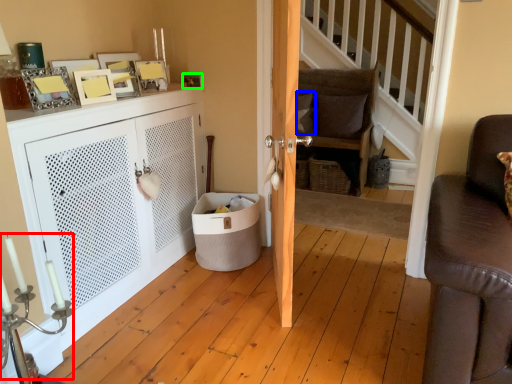
Question: Estimate the real-world distances between objects in this image. Which object is farther from candle holder (highlighted by a red box), pillow (highlighted by a blue box) or picture frame (highlighted by a green box)?

Choices:
 (A) pillow
 (B) picture frame

Answer: (A)